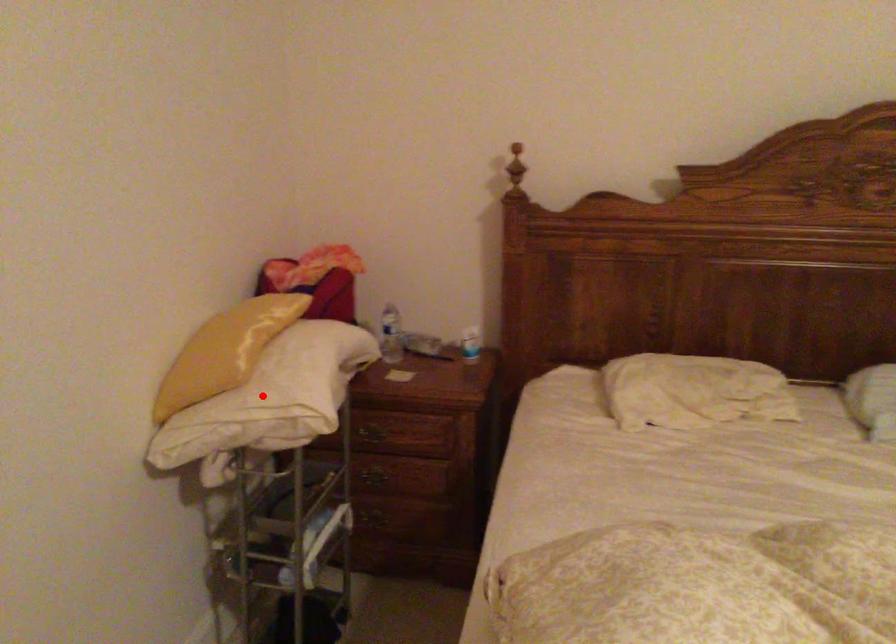
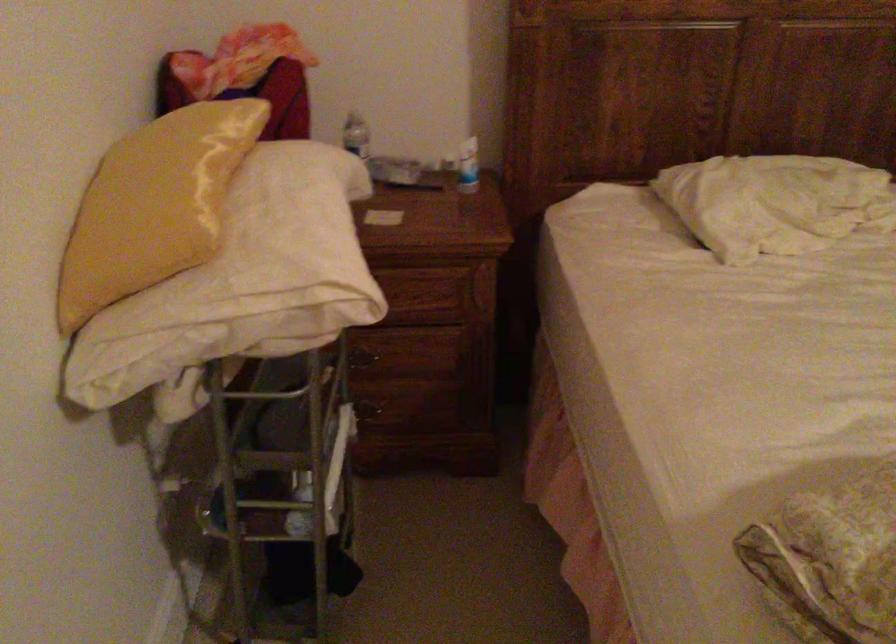
Find the pixel in the second image that matches the highlighted location in the first image.

(254, 272)